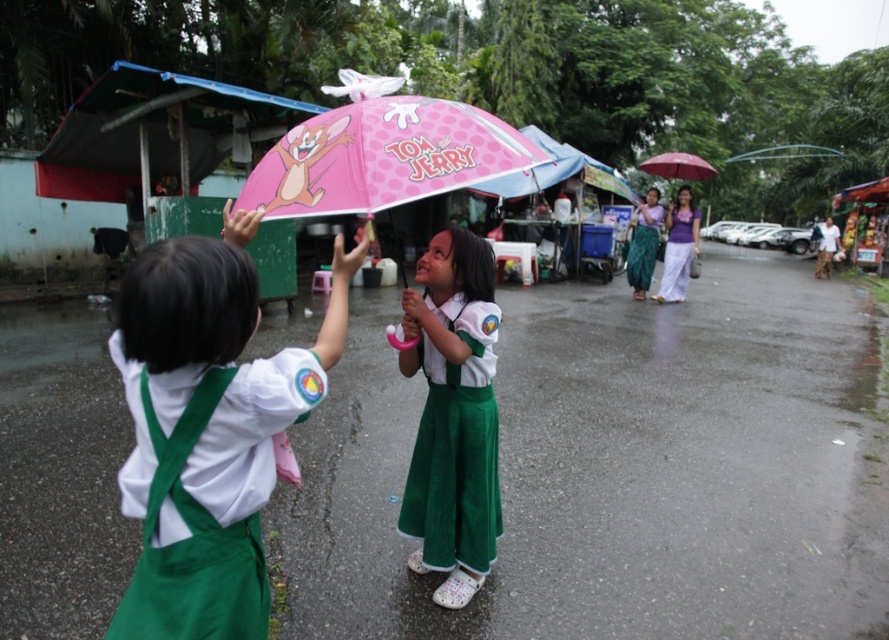
Question: Which object is positioned farthest from the matte pink umbrella at center?

Choices:
 (A) pink polka dot umbrella at upper center
 (B) purple cotton dress at center
 (C) velvety green dress at center
 (D) green textured dress at center

Answer: (A)

Question: Considering the relative positions of green textured dress at center and pink polka dot umbrella at upper center in the image provided, where is green textured dress at center located with respect to pink polka dot umbrella at upper center?

Choices:
 (A) left
 (B) right

Answer: (A)

Question: Estimate the real-world distances between objects in this image. Which object is closer to the pink matte umbrella at center?

Choices:
 (A) purple cotton dress at center
 (B) green textured dress at center
 (C) matte pink umbrella at center
 (D) pink polka dot umbrella at upper center

Answer: (C)

Question: Which point is closer to the camera?

Choices:
 (A) (463, 371)
 (B) (638, 232)
 (C) (163, 458)
 (D) (677, 170)

Answer: (C)

Question: Can you confirm if matte pink umbrella at center is bigger than velvety green dress at center?

Choices:
 (A) yes
 (B) no

Answer: (A)

Question: Can you confirm if pink matte umbrella at center is positioned below pink polka dot umbrella at upper center?

Choices:
 (A) yes
 (B) no

Answer: (A)